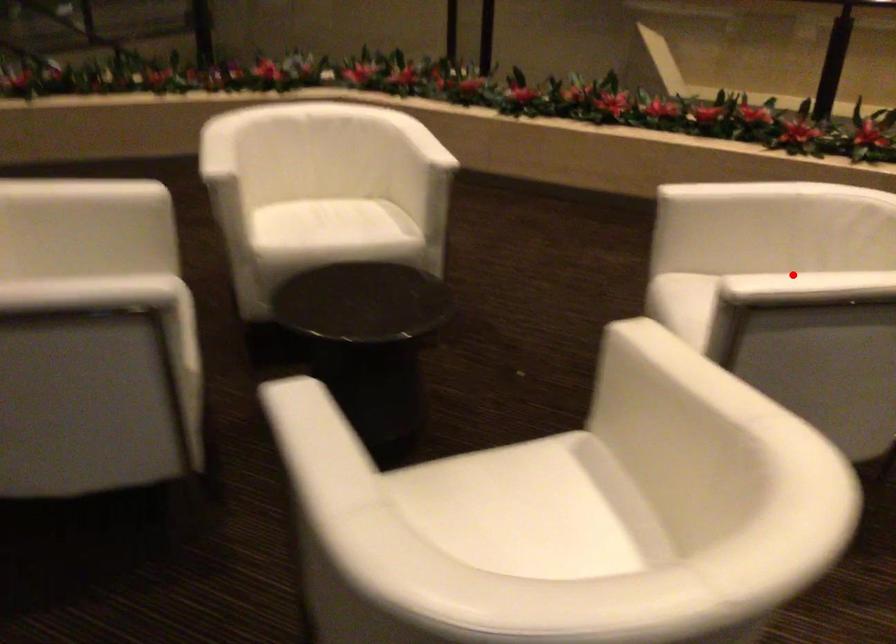
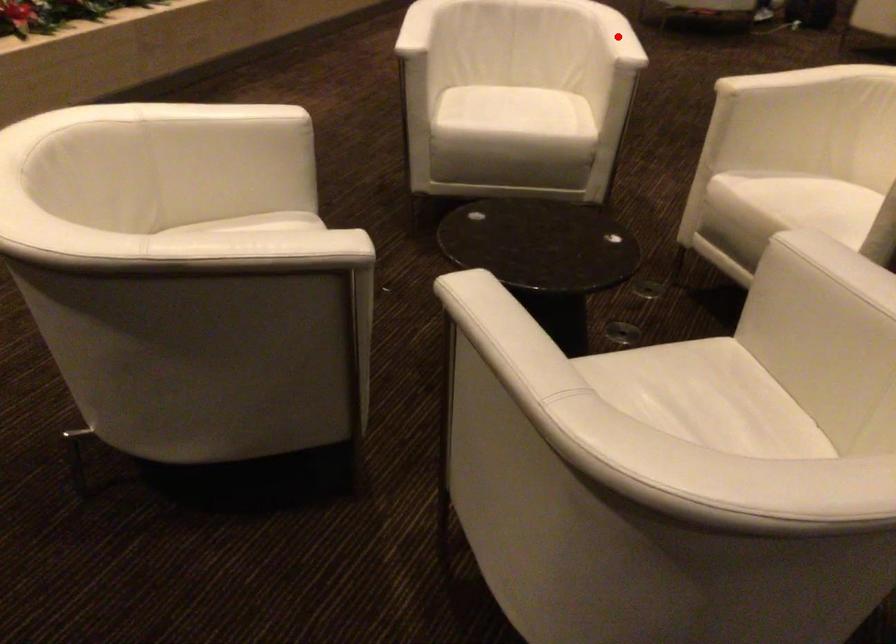
I am providing you with two images of the same scene from different viewpoints. A red point is marked on the first image and another point is marked on the second image. Does the point marked in image1 correspond to the same location as the one in image2?

Yes